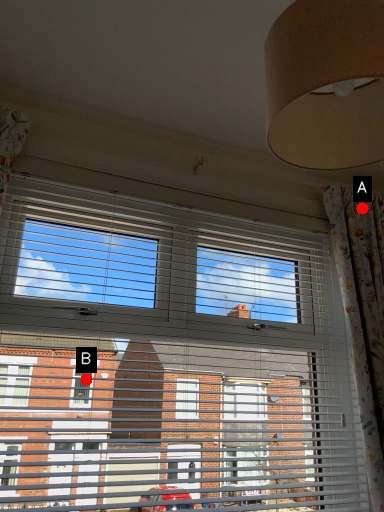
Question: Two points are circled on the image, labeled by A and B beside each circle. Which point is closer to the camera?

Choices:
 (A) A is closer
 (B) B is closer

Answer: (B)